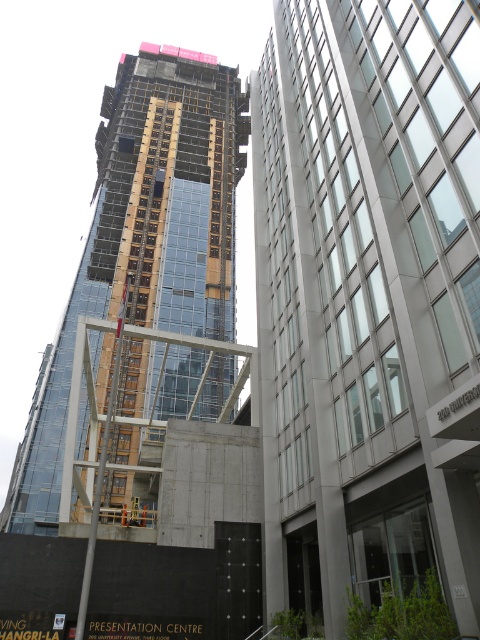
Question: Which point is closer to the camera taking this photo?

Choices:
 (A) (224, 163)
 (B) (389, 156)

Answer: (B)

Question: Is glassy concrete skyscraper at center positioned at the back of glassy steel tower at center?

Choices:
 (A) no
 (B) yes

Answer: (A)

Question: Which point is farther from the camera taking this photo?

Choices:
 (A) (58, 518)
 (B) (260, 380)

Answer: (A)

Question: Is glassy concrete skyscraper at center to the right of glassy steel tower at center from the viewer's perspective?

Choices:
 (A) no
 (B) yes

Answer: (B)

Question: Does glassy concrete skyscraper at center appear on the left side of glassy steel tower at center?

Choices:
 (A) yes
 (B) no

Answer: (B)